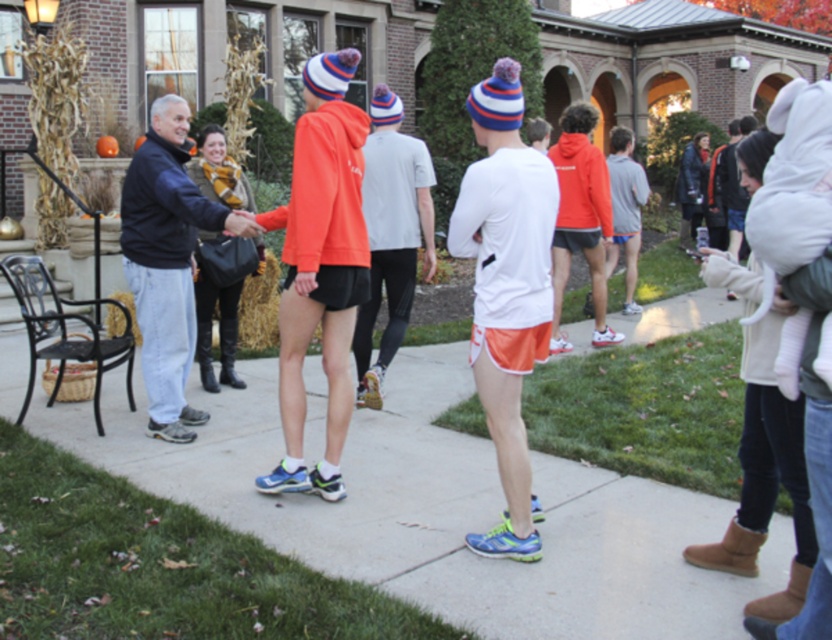
Find the location of `white matte long-sleeve shirt at center`. white matte long-sleeve shirt at center is located at coordinates (506, 291).

Locate an element on the screen. white matte long-sleeve shirt at center is located at coordinates (506, 291).

Measure the distance between point (x=15, y=396) and camera.

Point (x=15, y=396) is 22.83 feet from camera.

Can you confirm if concrete pavement at center is bigger than dark blue jacket at left?

Actually, concrete pavement at center might be smaller than dark blue jacket at left.

What do you see at coordinates (439, 508) in the screenshot? I see `concrete pavement at center` at bounding box center [439, 508].

The image size is (832, 640). In order to click on concrete pavement at center in this screenshot , I will do `click(439, 508)`.

Is concrete pavement at center behind white matte long-sleeve shirt at center?

No.

Is concrete pavement at center thinner than white matte long-sleeve shirt at center?

No, concrete pavement at center is not thinner than white matte long-sleeve shirt at center.

Who is more distant from viewer, (x=558, y=525) or (x=489, y=257)?

Point (x=558, y=525)

Locate an element on the screen. The width and height of the screenshot is (832, 640). concrete pavement at center is located at coordinates (439, 508).